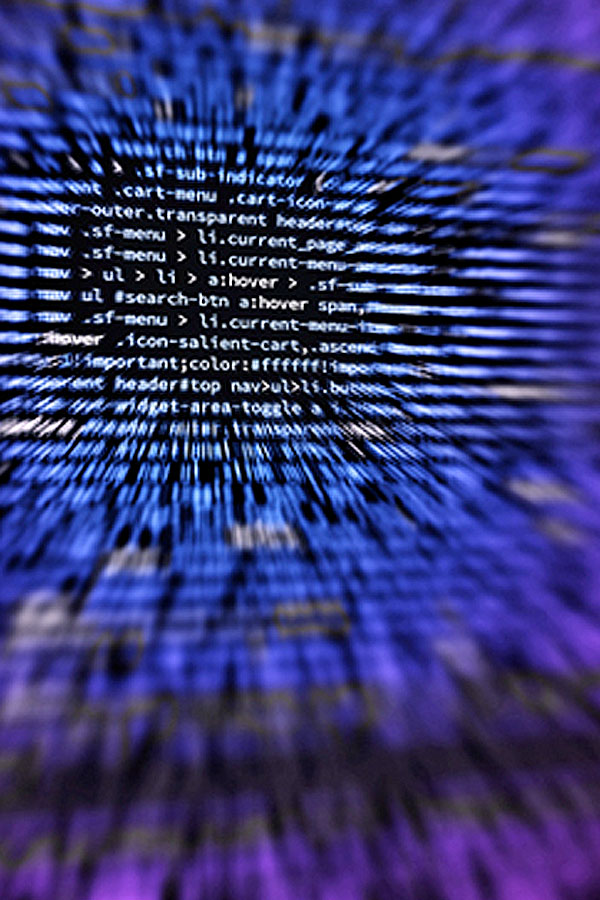
Where is `computer screen`? The height and width of the screenshot is (900, 600). computer screen is located at coordinates (278, 317).